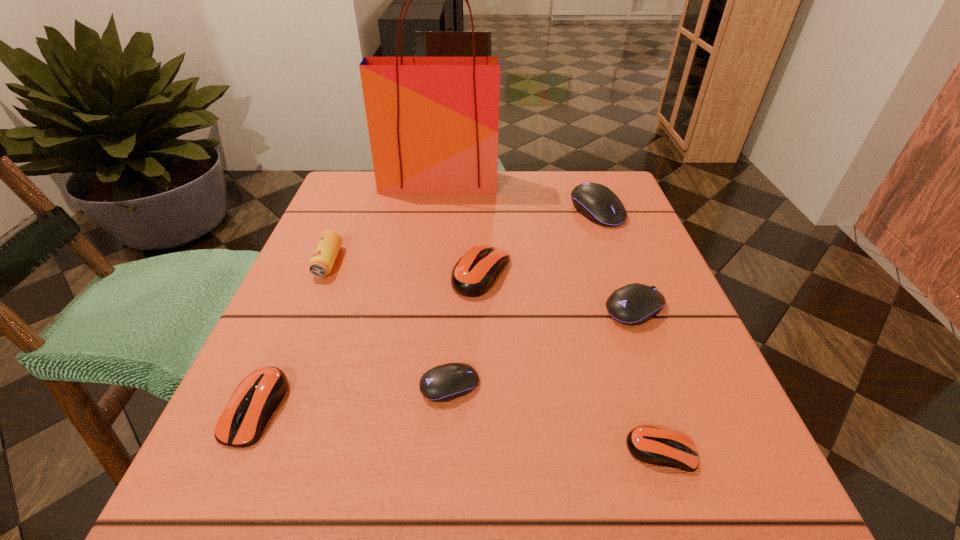
This screenshot has height=540, width=960. Find the location of `shopping bag`. shopping bag is located at coordinates (433, 122).

The image size is (960, 540). I want to click on blue shopping bag, so point(433,122).

Where is `the farthest black computer mouse`? the farthest black computer mouse is located at coordinates (596, 202).

In order to click on the farthest computer mouse in this screenshot , I will do `click(596, 202)`.

At what (x,y) coordinates should I click in order to perform the action: click on beer can. Please return your answer as a coordinate pair (x, y). Looking at the image, I should click on (321, 263).

What are the coordinates of `the second orange computer mouse from right to left` in the screenshot? It's located at (473, 275).

At what (x,y) coordinates should I click in order to perform the action: click on the farthest orange computer mouse. Please return your answer as a coordinate pair (x, y). This screenshot has width=960, height=540. Looking at the image, I should click on (473, 275).

Where is `the second farthest black computer mouse`? The width and height of the screenshot is (960, 540). the second farthest black computer mouse is located at coordinates (634, 304).

This screenshot has width=960, height=540. Identify the location of the leftmost orange computer mouse. (255, 399).

At what (x,y) coordinates should I click in order to perform the action: click on the second biggest orange computer mouse. Please return your answer as a coordinate pair (x, y). Image resolution: width=960 pixels, height=540 pixels. Looking at the image, I should click on (255, 399).